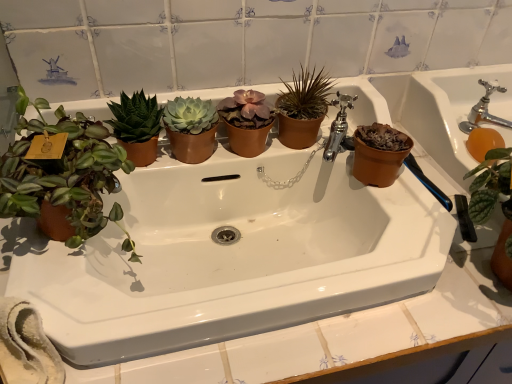
Question: Is silver metallic faucet at upper right, which is the first tap in right-to-left order, to the left or to the right of matte brown pot at left, the 1th houseplant from the left, in the image?

Choices:
 (A) right
 (B) left

Answer: (A)

Question: Which is correct: silver metallic faucet at upper right, the second tap when ordered from left to right, is inside matte brown pot at left, the 1th houseplant from the left, or outside of it?

Choices:
 (A) outside
 (B) inside

Answer: (A)

Question: Which object is positioned closest to the chrome metallic faucet at upper center, the 2th tap in the right-to-left sequence?

Choices:
 (A) white ceramic sink at center
 (B) green matte succulent at upper center, positioned as the 2th houseplant in right-to-left order
 (C) brown matte pot at center, marked as the first houseplant in a right-to-left arrangement
 (D) brown terracotta pot at right
 (E) silver metallic faucet at upper right, which is the first tap in right-to-left order

Answer: (C)

Question: Which object is the closest to the brown terracotta pot at right?

Choices:
 (A) white ceramic sink at center
 (B) matte brown pot at left, the 1th houseplant from the left
 (C) green matte succulent at upper center, the second houseplant in the left-to-right sequence
 (D) chrome metallic faucet at upper center, the 2th tap in the right-to-left sequence
 (E) silver metallic faucet at upper right, which is the first tap in right-to-left order

Answer: (D)